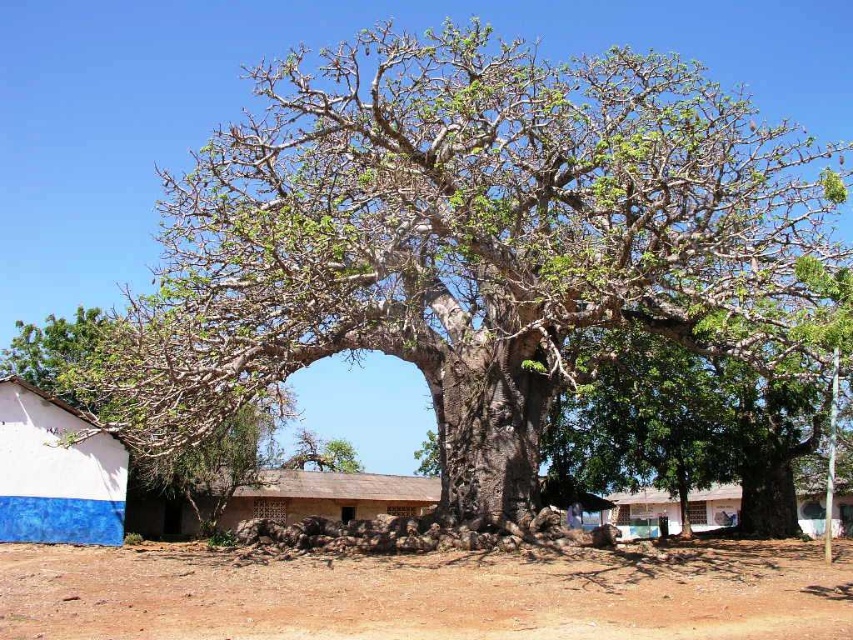
Question: Is brown dirt field at lower center to the left of green rough bark tree at center from the viewer's perspective?

Choices:
 (A) no
 (B) yes

Answer: (B)

Question: Is brown dirt field at lower center bigger than white painted wood hut at center?

Choices:
 (A) no
 (B) yes

Answer: (B)

Question: Can you confirm if white painted wood hut at center is positioned below green rough bark tree at center?

Choices:
 (A) yes
 (B) no

Answer: (A)

Question: Estimate the real-world distances between objects in this image. Which object is closer to the white painted wood hut at center?

Choices:
 (A) brown dirt field at lower center
 (B) green rough bark tree at center

Answer: (B)

Question: Estimate the real-world distances between objects in this image. Which object is closer to the brown clay hut at center?

Choices:
 (A) brown dirt field at lower center
 (B) green rough bark tree at center

Answer: (B)

Question: Which of these objects is positioned closest to the brown clay hut at center?

Choices:
 (A) brown dirt field at lower center
 (B) white painted wall at lower left
 (C) green rough bark tree at center

Answer: (C)